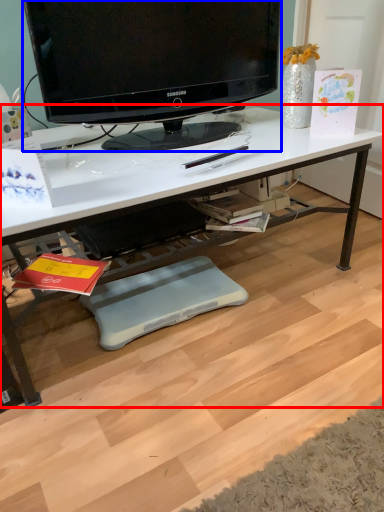
Question: Among these objects, which one is nearest to the camera, desk (highlighted by a red box) or television (highlighted by a blue box)?

Choices:
 (A) desk
 (B) television

Answer: (A)